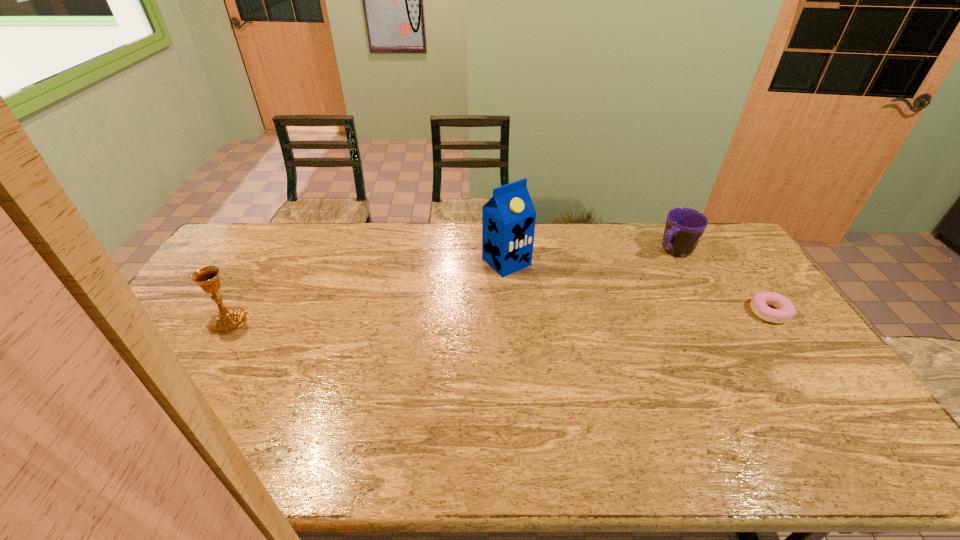
Find the location of `the leftmost object`. the leftmost object is located at coordinates (227, 319).

Identify the location of chalice. click(227, 319).

Identify the location of the rightmost object. This screenshot has width=960, height=540. pyautogui.click(x=759, y=303).

This screenshot has width=960, height=540. I want to click on the shortest object, so click(x=759, y=303).

The width and height of the screenshot is (960, 540). Identify the location of the tallest object. (508, 219).

Where is `carton`? carton is located at coordinates (508, 219).

The image size is (960, 540). I want to click on mug, so click(684, 227).

Locate an element on the screen. The height and width of the screenshot is (540, 960). the third object from left to right is located at coordinates (684, 227).

What are the coordinates of `free location located 0.360m on the back of the second tallest object` in the screenshot? It's located at (x=276, y=240).

Image resolution: width=960 pixels, height=540 pixels. I want to click on free space located 0.220m on the back of the rightmost object, so click(x=732, y=257).